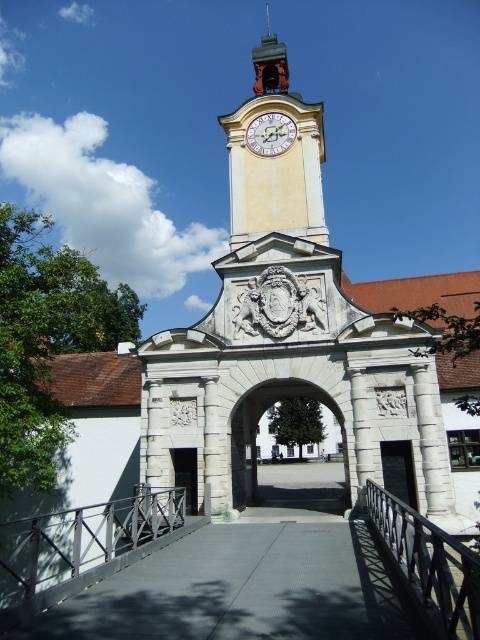
Is yellow stone clock tower at upper center bigger than black wrought iron railing at lower right?

Indeed, yellow stone clock tower at upper center has a larger size compared to black wrought iron railing at lower right.

Does point (323, 234) lie in front of point (445, 604)?

No, it is behind (445, 604).

The height and width of the screenshot is (640, 480). I want to click on yellow stone clock tower at upper center, so click(x=275, y=156).

Which is above, yellow stone clock tower at center or black metal/rail at lower left?

yellow stone clock tower at center is higher up.

Is point (233, 417) positioned behind point (24, 552)?

No, it is in front of (24, 552).

The width and height of the screenshot is (480, 640). Find the location of `yellow stone clock tower at center`. yellow stone clock tower at center is located at coordinates (289, 346).

Does black metal/rail at lower left appear on the left side of white painted wood clock at upper center?

Yes, black metal/rail at lower left is to the left of white painted wood clock at upper center.

Does point (147, 513) come closer to viewer compared to point (264, 125)?

Yes, point (147, 513) is closer to viewer.

Where is `black metal/rail at lower left`? The height and width of the screenshot is (640, 480). black metal/rail at lower left is located at coordinates point(81,540).